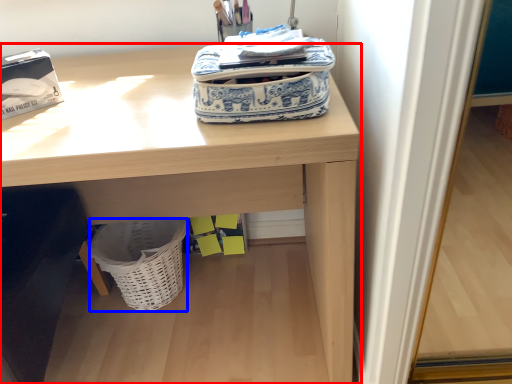
Question: Which object appears closest to the camera in this image, desk (highlighted by a red box) or basket (highlighted by a blue box)?

Choices:
 (A) desk
 (B) basket

Answer: (A)